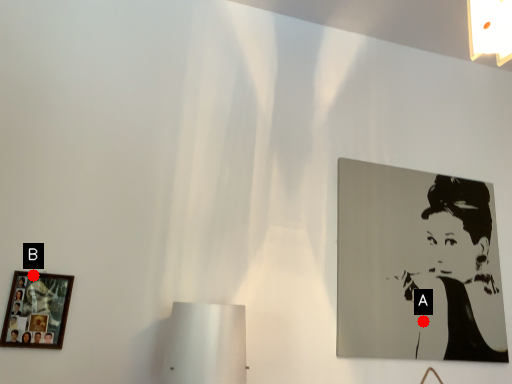
Question: Two points are circled on the image, labeled by A and B beside each circle. Which point is closer to the camera?

Choices:
 (A) A is closer
 (B) B is closer

Answer: (B)